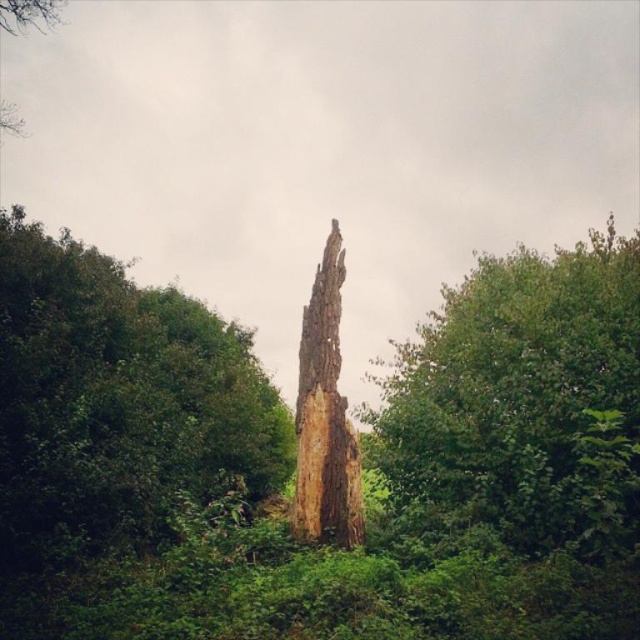
Is point (188, 339) farther from viewer compared to point (317, 442)?

Yes, it is behind point (317, 442).

From the picture: Is rough bark tree at center smaller than brown rough tree trunk at center?

No.

Is point (93, 545) positioned before point (355, 465)?

Yes, point (93, 545) is closer to viewer.

The height and width of the screenshot is (640, 640). Find the location of `rough bark tree at center`. rough bark tree at center is located at coordinates (116, 403).

Between rough bark tree at center and smooth brown tree trunk at center, which one appears on the left side from the viewer's perspective?

From the viewer's perspective, rough bark tree at center appears more on the left side.

In the scene shown: Is rough bark tree at center thinner than smooth brown tree trunk at center?

Yes, rough bark tree at center is thinner than smooth brown tree trunk at center.

What do you see at coordinates (116, 403) in the screenshot?
I see `rough bark tree at center` at bounding box center [116, 403].

What are the coordinates of `rough bark tree at center` in the screenshot? It's located at (116, 403).

What do you see at coordinates (524, 400) in the screenshot? This screenshot has height=640, width=640. I see `smooth brown tree trunk at center` at bounding box center [524, 400].

Is smooth brown tree trunk at center wider than brown rough tree trunk at center?

Indeed, smooth brown tree trunk at center has a greater width compared to brown rough tree trunk at center.

Locate an element on the screen. smooth brown tree trunk at center is located at coordinates (524, 400).

Where is `smooth brown tree trunk at center`? This screenshot has height=640, width=640. smooth brown tree trunk at center is located at coordinates (524, 400).